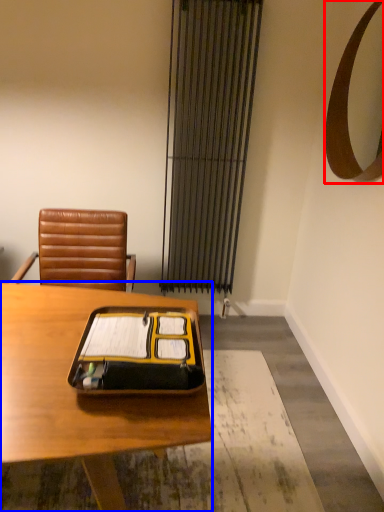
Question: Which object appears closest to the camera in this image, mirror (highlighted by a red box) or desk (highlighted by a blue box)?

Choices:
 (A) mirror
 (B) desk

Answer: (B)